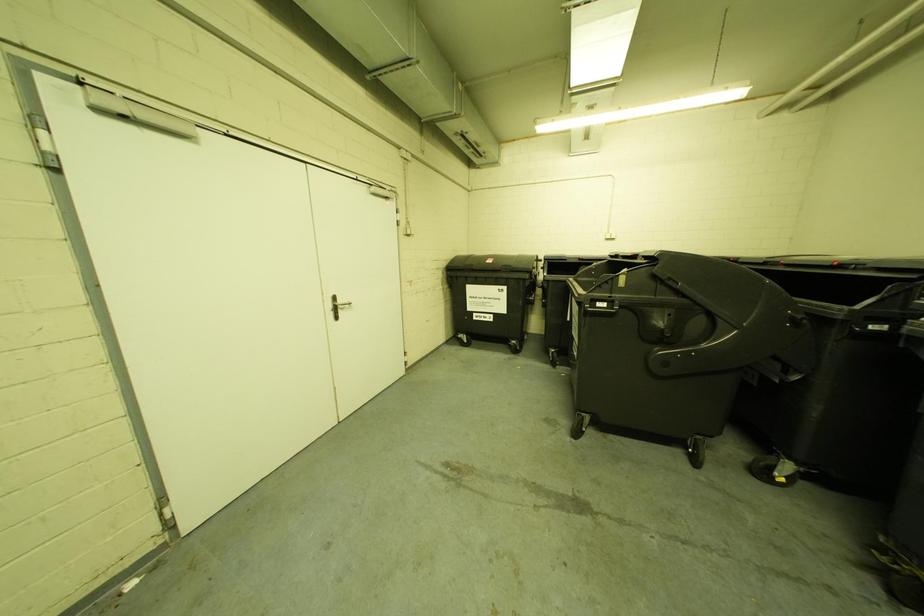
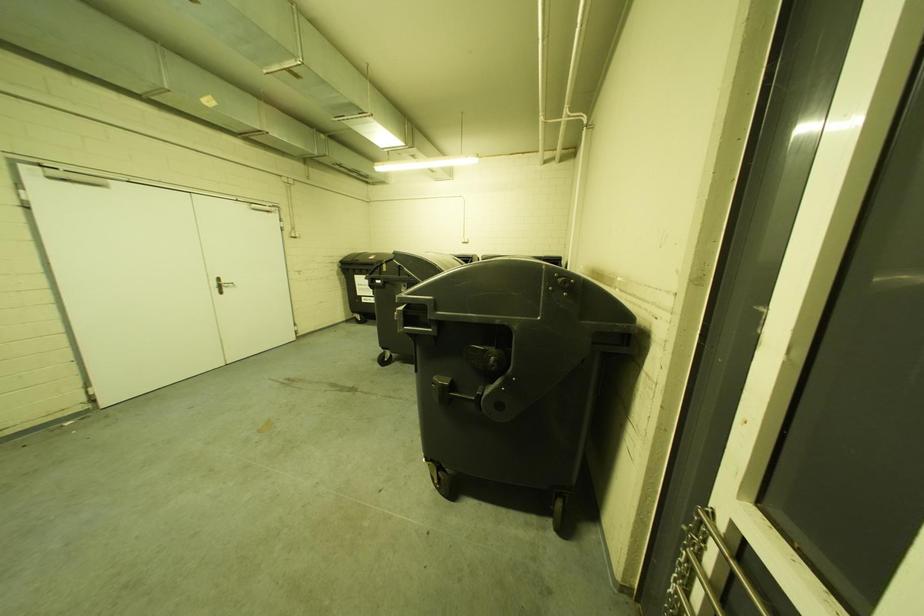
The images are taken continuously from a first-person perspective. In which direction are you moving?

The movement direction of the cameraman is right, backward.